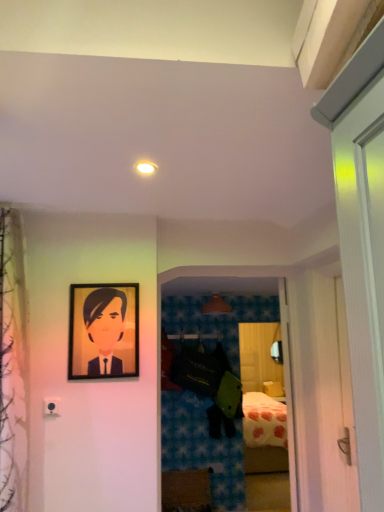
Question: From their relative heights in the image, would you say matte brown lampshade at center is taller or shorter than wooden chest of drawers at lower center?

Choices:
 (A) tall
 (B) short

Answer: (B)

Question: From the image's perspective, is matte brown lampshade at center positioned above or below wooden chest of drawers at lower center?

Choices:
 (A) above
 (B) below

Answer: (A)

Question: Estimate the real-world distances between objects in this image. Which object is farther from the matte black portrait at upper left?

Choices:
 (A) wooden chest of drawers at lower center
 (B) matte white light fixture at upper center
 (C) matte brown lampshade at center

Answer: (A)

Question: Which is farther from the wooden chest of drawers at lower center?

Choices:
 (A) matte white light fixture at upper center
 (B) matte brown lampshade at center
 (C) matte black portrait at upper left

Answer: (A)